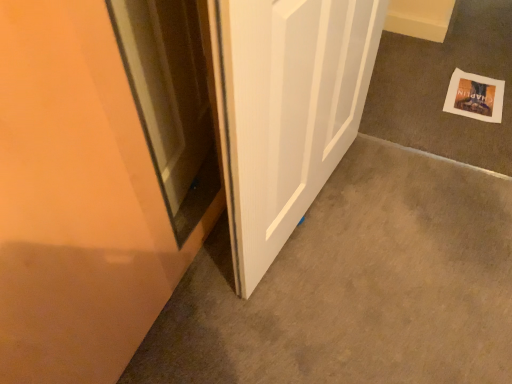
Question: Visually, is white wood door at center positioned to the left or to the right of white paper at lower right?

Choices:
 (A) left
 (B) right

Answer: (A)

Question: Relative to white paper at lower right, is white wood door at center in front or behind?

Choices:
 (A) behind
 (B) front

Answer: (B)

Question: Does point (297, 177) appear closer or farther from the camera than point (475, 97)?

Choices:
 (A) farther
 (B) closer

Answer: (B)

Question: Is point (501, 107) positioned closer to the camera than point (373, 28)?

Choices:
 (A) closer
 (B) farther

Answer: (B)

Question: Is white paper at lower right wider or thinner than white wood door at center?

Choices:
 (A) wide
 (B) thin

Answer: (A)

Question: Is white paper at lower right taller or shorter than white wood door at center?

Choices:
 (A) tall
 (B) short

Answer: (B)

Question: From a real-world perspective, is white paper at lower right positioned above or below white wood door at center?

Choices:
 (A) above
 (B) below

Answer: (B)